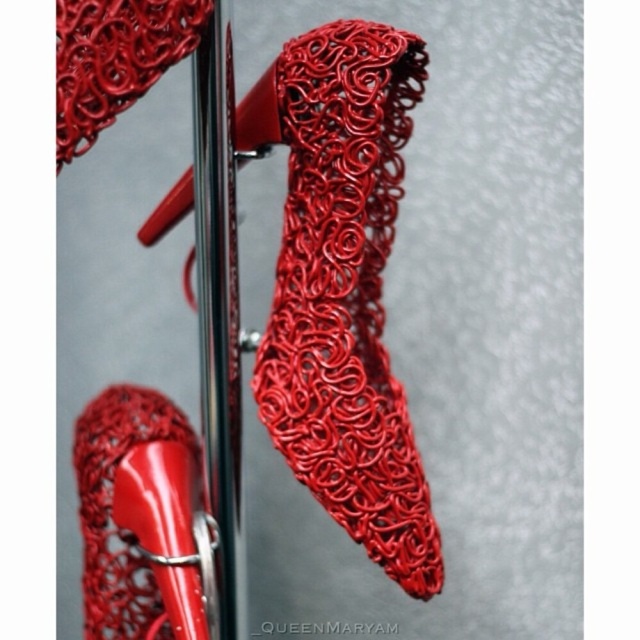
Does shiny red wire at center have a larger size compared to matte red shoe at center?

No, shiny red wire at center is not bigger than matte red shoe at center.

Is the position of shiny red wire at center less distant than that of matte red shoe at center?

Yes.

Find the location of a particular element. This screenshot has width=640, height=640. shiny red wire at center is located at coordinates (346, 292).